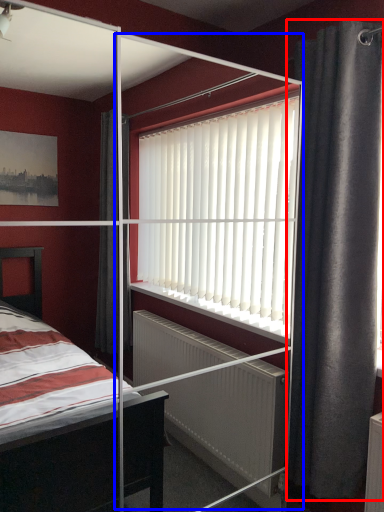
Question: Which object is further to the camera taking this photo, curtain (highlighted by a red box) or screen door (highlighted by a blue box)?

Choices:
 (A) curtain
 (B) screen door

Answer: (A)